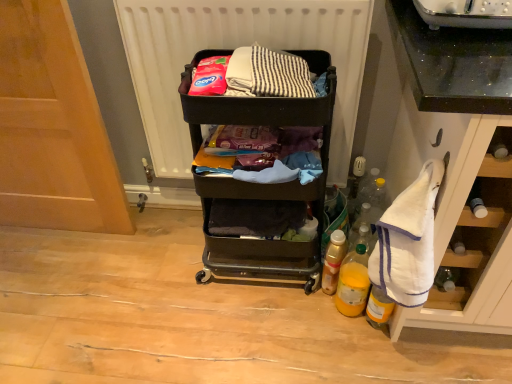
Where is `free location to the right of yellow matte bottle at lower right, arranged as the second bottle when viewed from the right`? The width and height of the screenshot is (512, 384). free location to the right of yellow matte bottle at lower right, arranged as the second bottle when viewed from the right is located at coordinates (412, 340).